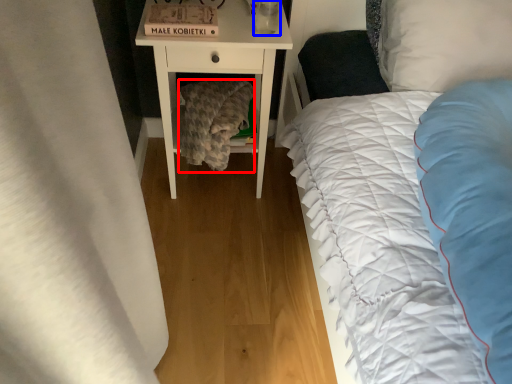
Question: Which object is closer to the camera taking this photo, blanket (highlighted by a red box) or glass vase (highlighted by a blue box)?

Choices:
 (A) blanket
 (B) glass vase

Answer: (B)